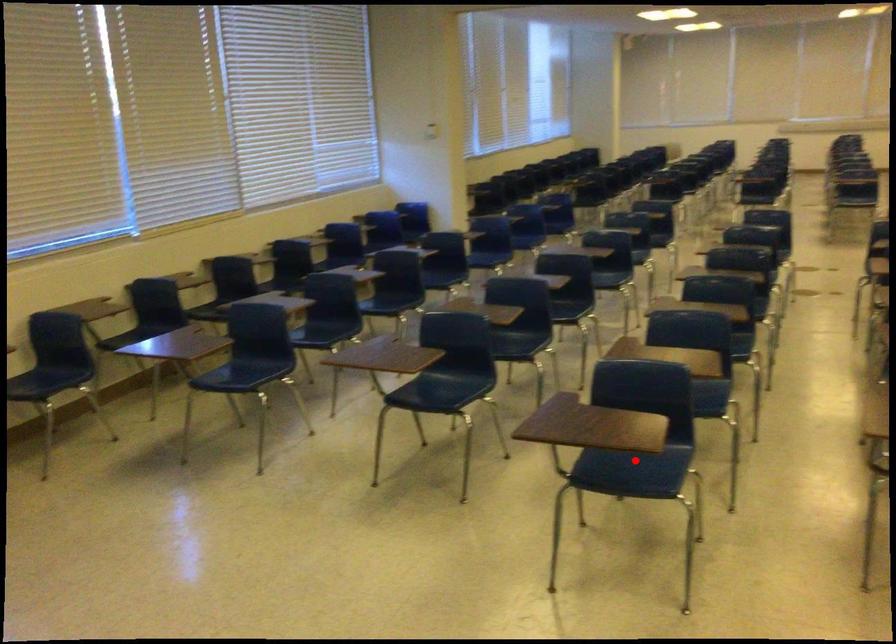
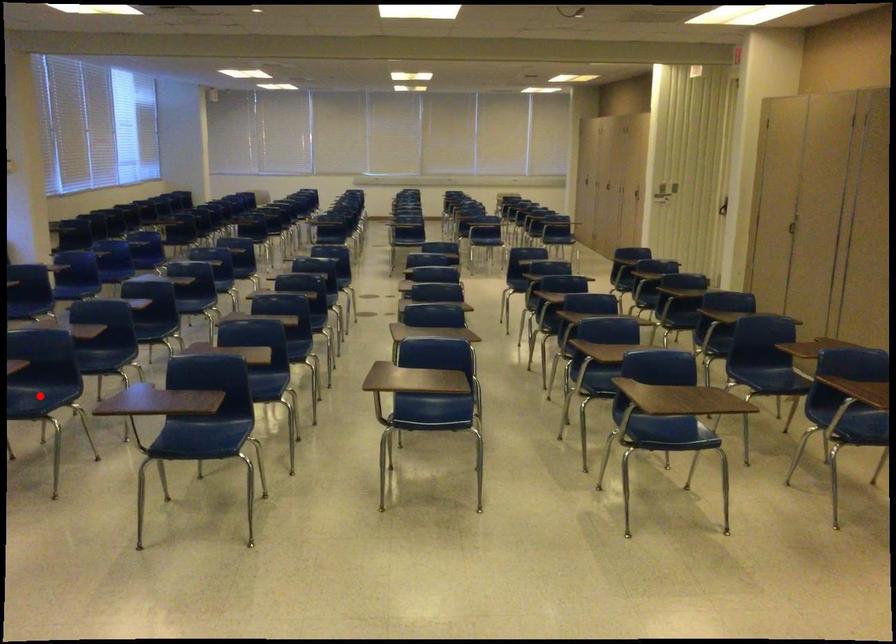
I am providing you with two images of the same scene from different viewpoints. A red point is marked on the first image and another point is marked on the second image. Is the marked point in image1 the same physical position as the marked point in image2?

No